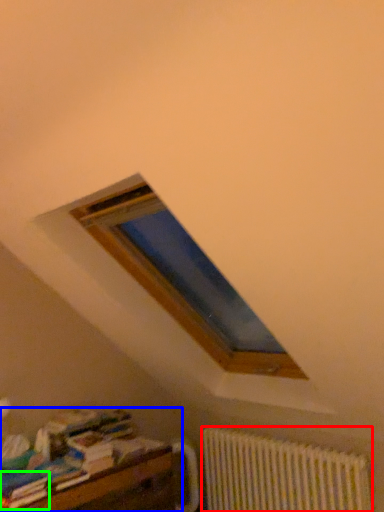
Question: Considering the real-world distances, which object is farthest from radiator (highlighted by a red box)? furniture (highlighted by a blue box) or paperback book (highlighted by a green box)?

Choices:
 (A) furniture
 (B) paperback book

Answer: (B)